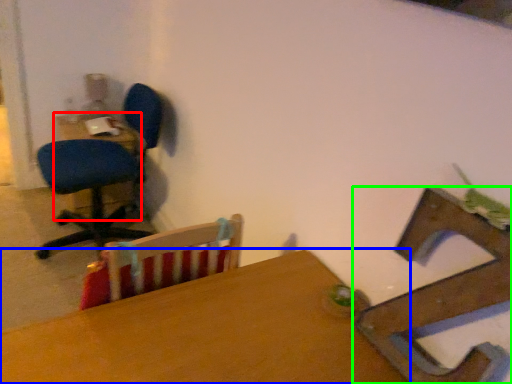
Question: Which object is positioned closest to table (highlighted by a red box)? Select from table (highlighted by a blue box) and chair (highlighted by a green box).

Choices:
 (A) table
 (B) chair

Answer: (A)